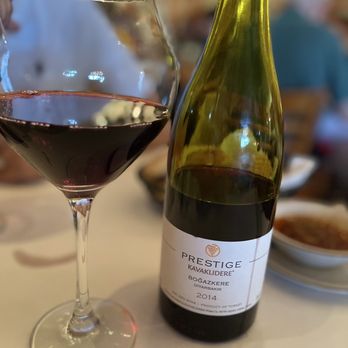
Identify the location of white plate. The width and height of the screenshot is (348, 348). (322, 282).